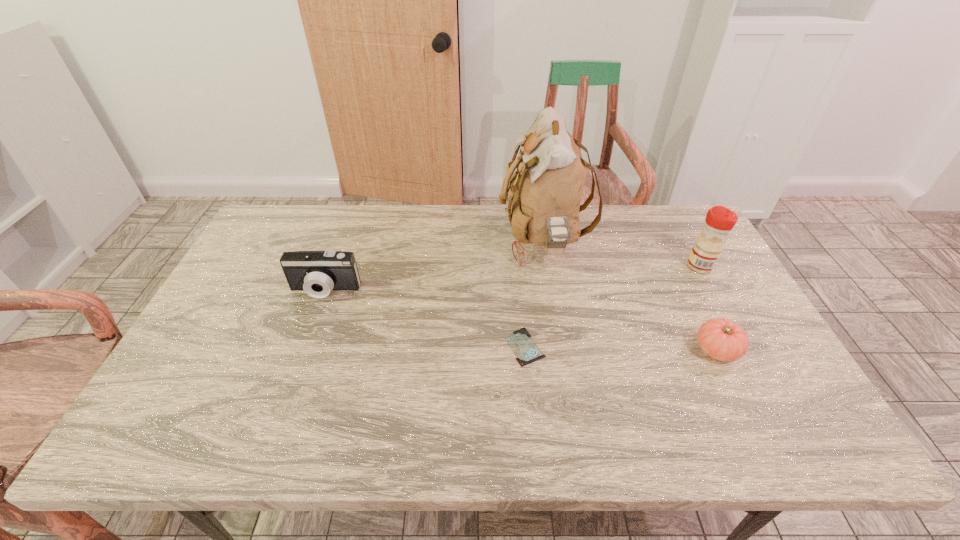
Where is `free spot between the tomato and the second tallest object`? free spot between the tomato and the second tallest object is located at coordinates (708, 308).

Identify the location of blank region between the shortest object and the tomato. (621, 348).

Select which object appears as the closest to the tallest object. Please provide its 2D coordinates. Your answer should be formatted as a tuple, i.e. [(x, y)], where the tuple contains the x and y coordinates of a point satisfying the conditions above.

[(526, 351)]

Select which object appears as the fourth closest to the condiment. Please provide its 2D coordinates. Your answer should be formatted as a tuple, i.e. [(x, y)], where the tuple contains the x and y coordinates of a point satisfying the conditions above.

[(317, 273)]

Identify the location of free space that satisfies the following two spatial constraints: 1. on the lens of the tomato; 2. on the left side of the camcorder. (303, 350).

Where is `vacant space that satisfies the following two spatial constraints: 1. on the front-facing side of the backpack; 2. on the left side of the second shortest object`? This screenshot has height=540, width=960. vacant space that satisfies the following two spatial constraints: 1. on the front-facing side of the backpack; 2. on the left side of the second shortest object is located at coordinates (561, 350).

Identify the location of free region that satisfies the following two spatial constraints: 1. on the front-facing side of the backpack; 2. on the back side of the tomato. This screenshot has height=540, width=960. (561, 350).

The image size is (960, 540). What are the coordinates of `vacant space that satisfies the following two spatial constraints: 1. on the lens of the shortest object; 2. on the left side of the leftmost object` in the screenshot? It's located at (304, 347).

The width and height of the screenshot is (960, 540). I want to click on free location that satisfies the following two spatial constraints: 1. on the lens of the shortest object; 2. on the right side of the camcorder, so click(304, 347).

Where is `vacant area in the image that satisfies the following two spatial constraints: 1. on the back side of the fourth shortest object; 2. on the front-facing side of the backpack`? Image resolution: width=960 pixels, height=540 pixels. vacant area in the image that satisfies the following two spatial constraints: 1. on the back side of the fourth shortest object; 2. on the front-facing side of the backpack is located at coordinates (687, 242).